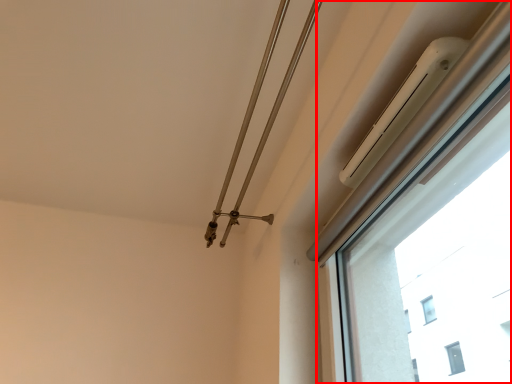
Question: Where is window (annotated by the red box) located in relation to twin in the image?

Choices:
 (A) right
 (B) left

Answer: (A)